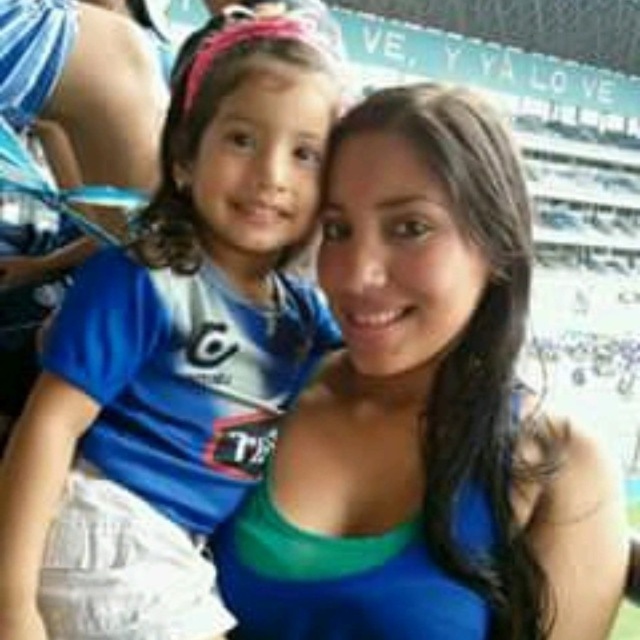
You are a photographer trying to capture a candid shot of the two people in the image. You want to focus on the person closer to the camera. Which point should you aim your camera at, point (385,461) or point (12,488)?

Point (385,461) is further to the camera than point (12,488), so you should aim your camera at point (385,461) to focus on the person closer to the camera.

You are a photographer at the soccer match and need to capture a clear shot of both the blue fabric dress at center and the blue jersey at left. Which one is closer to the camera?

The blue fabric dress at center is closer to the camera than the blue jersey at left.